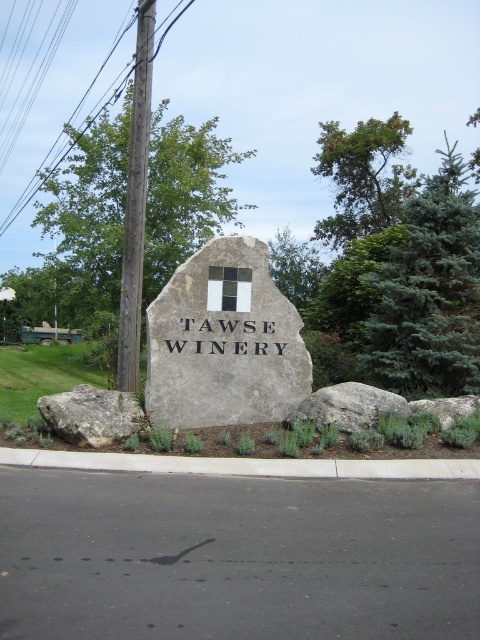
Can you confirm if gray stone sign at center is positioned below white concrete curb at lower center?

Incorrect, gray stone sign at center is not positioned below white concrete curb at lower center.

Who is shorter, gray stone sign at center or white concrete curb at lower center?

white concrete curb at lower center is shorter.

Identify the location of gray stone sign at center. This screenshot has height=640, width=480. click(224, 340).

Between wooden utility pole at left and gray rock at center, which one is positioned higher?

Positioned higher is wooden utility pole at left.

Who is more distant from viewer, (130, 246) or (422, 406)?

Point (130, 246)

Find the location of a particular element. The height and width of the screenshot is (640, 480). wooden utility pole at left is located at coordinates [135, 204].

Does gray stone sign at center have a smaller size compared to wooden utility pole at left?

Yes.

Which is more to the left, gray stone sign at center or wooden utility pole at left?

Positioned to the left is wooden utility pole at left.

Does point (249, 241) come in front of point (119, 388)?

Yes, point (249, 241) is closer to viewer.

Locate an element on the screen. This screenshot has height=640, width=480. gray stone sign at center is located at coordinates (224, 340).